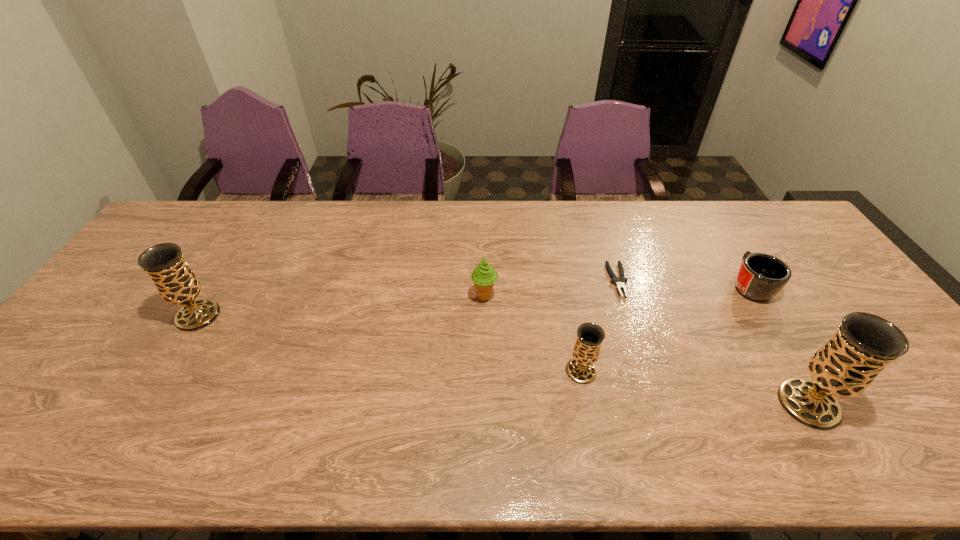
At what (x,y) coordinates should I click in order to perform the action: click on free space in the image that satisfies the following two spatial constraints: 1. on the front side of the rightmost chalice; 2. on the left side of the icecream. Please return your answer as a coordinate pair (x, y). Looking at the image, I should click on (486, 404).